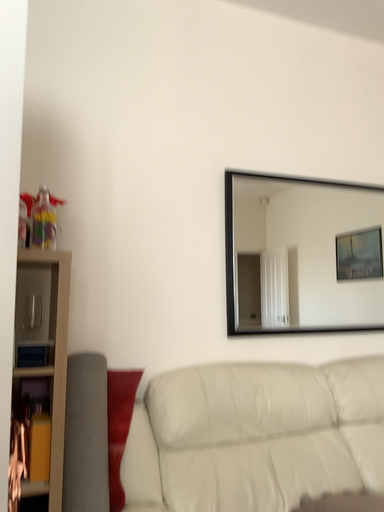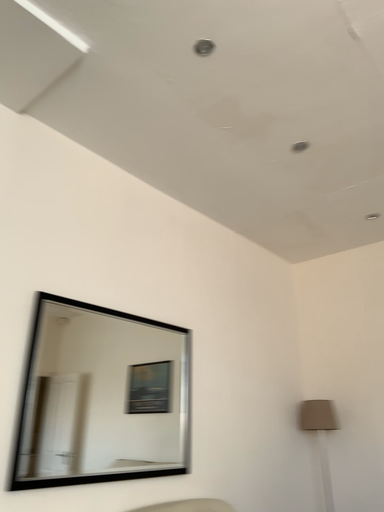
Question: How did the camera likely rotate when shooting the video?

Choices:
 (A) rotated right
 (B) rotated left

Answer: (A)